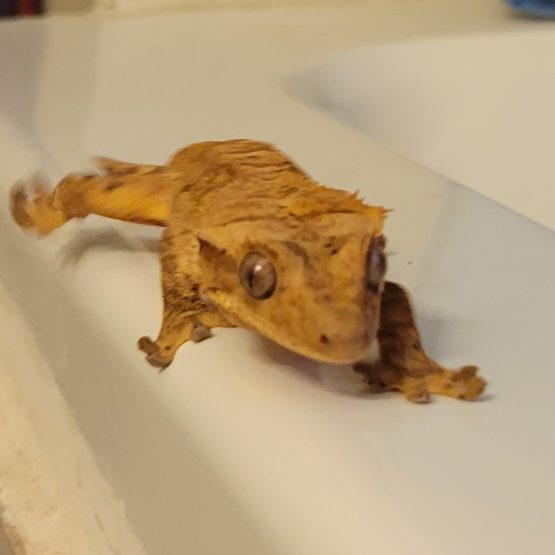
Where is `white counter`? The image size is (555, 555). white counter is located at coordinates (89, 44).